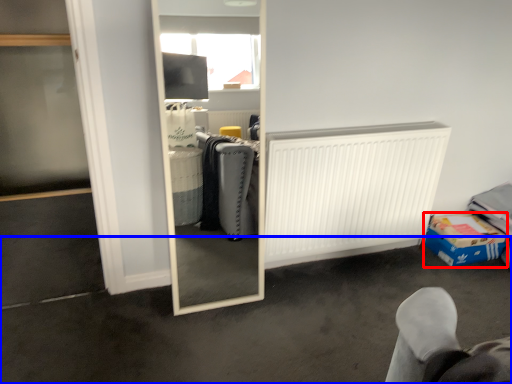
Question: Which object appears closest to the camera in this image, cardboard box (highlighted by a red box) or concrete (highlighted by a blue box)?

Choices:
 (A) cardboard box
 (B) concrete

Answer: (B)